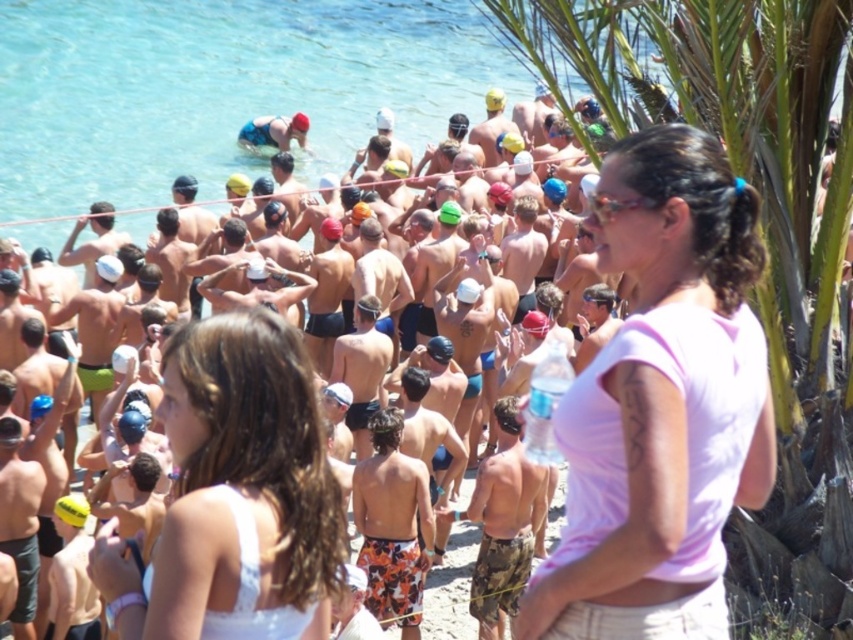
Question: Which of these objects is positioned farthest from the clear blue water at center?

Choices:
 (A) matte swim caps at center
 (B) white fabric at center
 (C) pink fabric shirt at center

Answer: (C)

Question: Can you confirm if clear blue water at center is bigger than matte swim caps at center?

Choices:
 (A) yes
 (B) no

Answer: (A)

Question: Estimate the real-world distances between objects in this image. Which object is farther from the clear blue water at center?

Choices:
 (A) white fabric at center
 (B) pink fabric shirt at center

Answer: (B)

Question: Does clear blue water at center have a larger size compared to matte swim caps at center?

Choices:
 (A) yes
 (B) no

Answer: (A)

Question: In this image, where is pink fabric shirt at center located relative to white fabric at center?

Choices:
 (A) right
 (B) left

Answer: (A)

Question: Which point is farther from the camera taking this photo?

Choices:
 (A) (631, 202)
 (B) (468, 628)

Answer: (B)